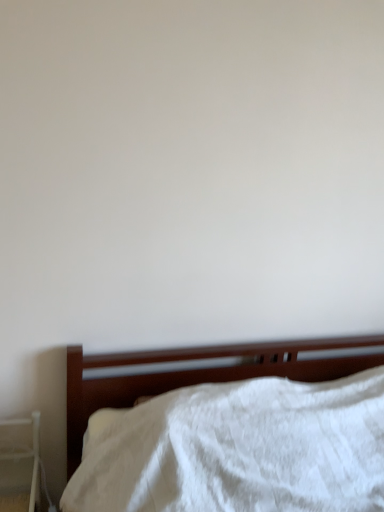
Describe the element at coordinates (241, 441) in the screenshot. I see `wooden bed at lower right` at that location.

I want to click on wooden bed at lower right, so click(x=241, y=441).

The height and width of the screenshot is (512, 384). In order to click on wooden bed at lower right in this screenshot , I will do `click(241, 441)`.